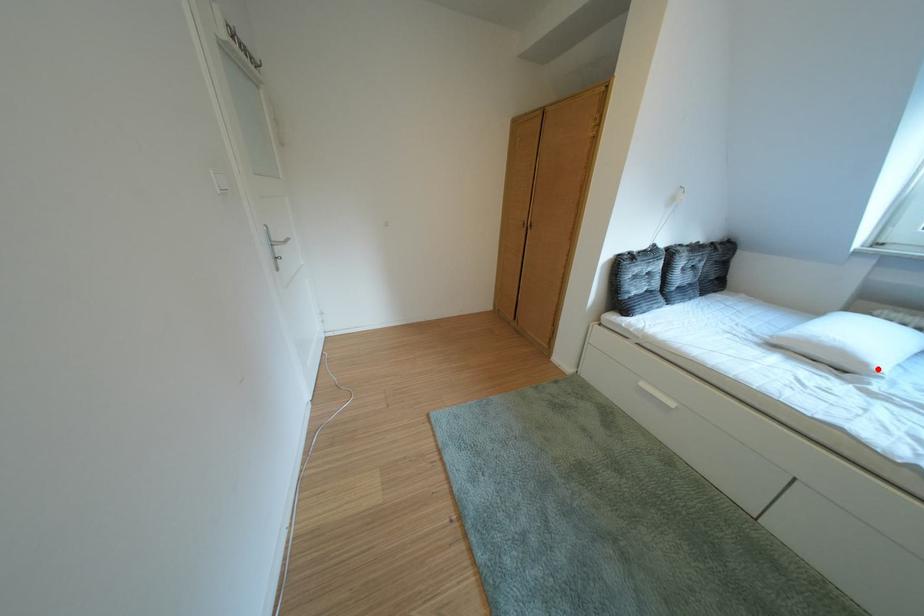
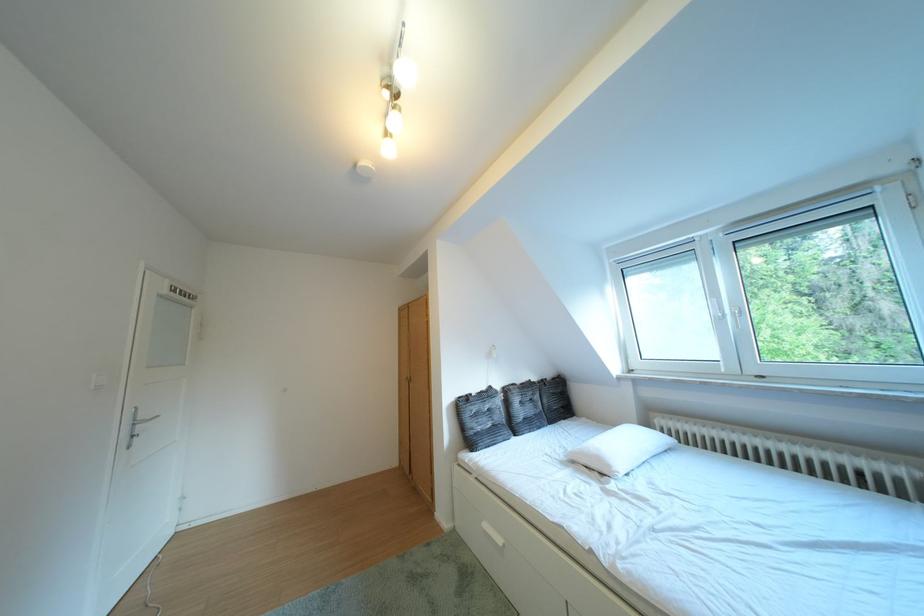
Question: A red point is marked in image1. In image2, is the corresponding 3D point closer to the camera or farther? Reply with the corresponding letter.

Choices:
 (A) The corresponding 3D point is closer.
 (B) The corresponding 3D point is farther.

Answer: (B)